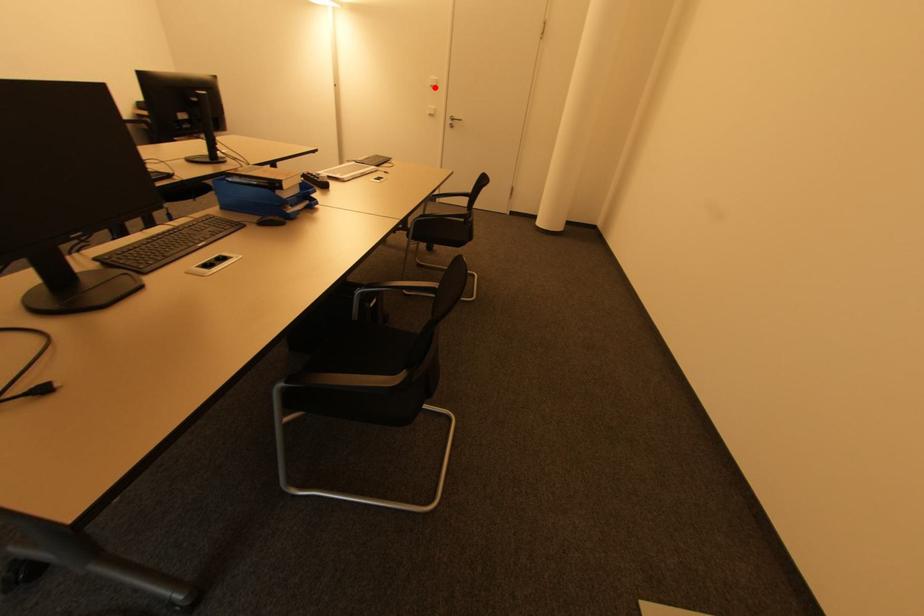
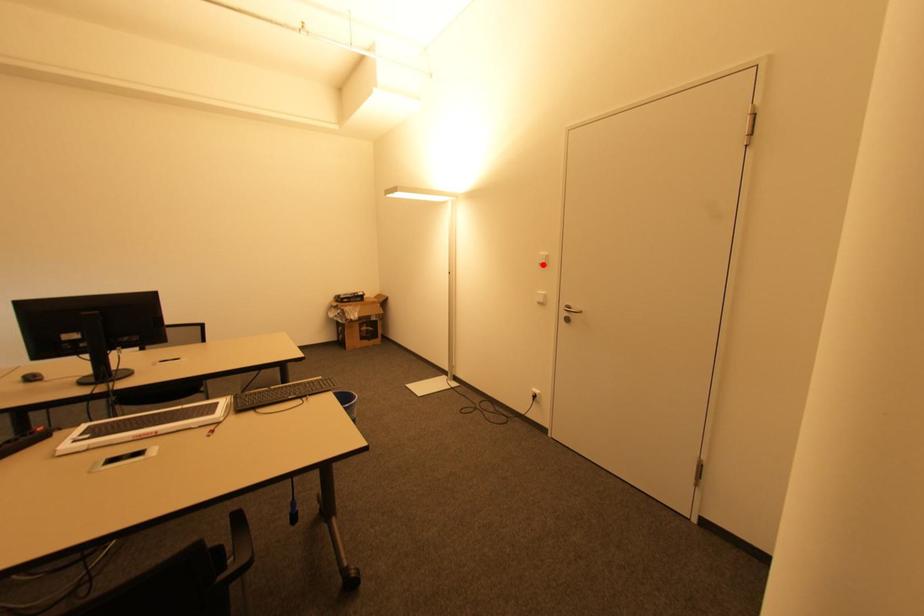
I am providing you with two images of the same scene from different viewpoints. A red point is marked on the first image and another point is marked on the second image. Do the highlighted points in image1 and image2 indicate the same real-world spot?

Yes